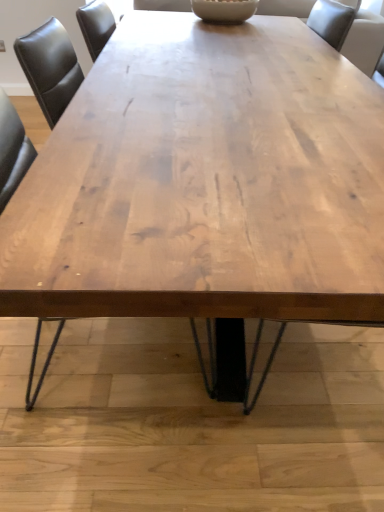
Find the location of a particular element. free location to the left of matte beige bowl at center is located at coordinates (153, 18).